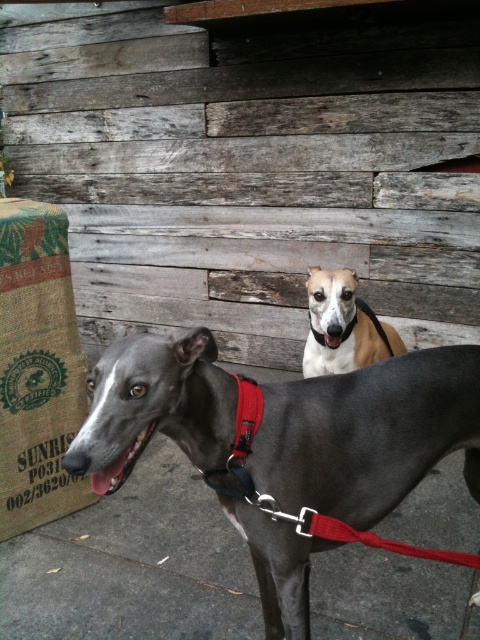
Question: Which point is closer to the camera?

Choices:
 (A) (22, 300)
 (B) (389, 336)

Answer: (A)

Question: Observing the image, what is the correct spatial positioning of shiny black dog at center in reference to light brown fur at center?

Choices:
 (A) above
 (B) below

Answer: (B)

Question: Considering the relative positions of burlap sack at left and light brown fur at center in the image provided, where is burlap sack at left located with respect to light brown fur at center?

Choices:
 (A) right
 (B) left

Answer: (B)

Question: Is shiny black dog at center to the left of light brown fur at center from the viewer's perspective?

Choices:
 (A) no
 (B) yes

Answer: (B)

Question: Which of the following is the farthest from the observer?

Choices:
 (A) light brown fur at center
 (B) shiny black dog at center

Answer: (A)

Question: Which object appears farthest from the camera in this image?

Choices:
 (A) light brown fur at center
 (B) shiny black dog at center

Answer: (A)